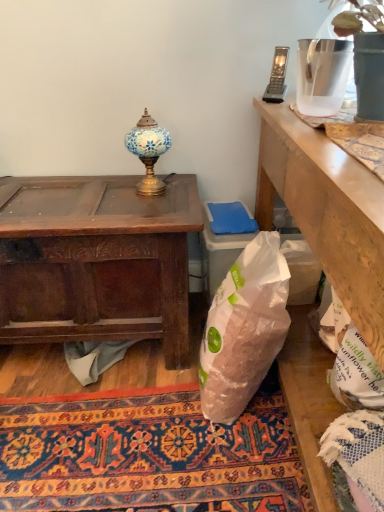
This screenshot has width=384, height=512. In order to click on vacant area that is in front of gray fabric at lower center in this screenshot , I will do `click(92, 412)`.